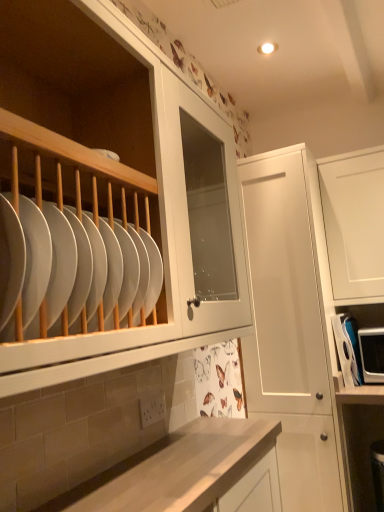
Question: Is point (349, 320) positioned closer to the camera than point (117, 284)?

Choices:
 (A) farther
 (B) closer

Answer: (A)

Question: From the image's perspective, is white plastic microwave at right located above or below white glossy plate at left?

Choices:
 (A) above
 (B) below

Answer: (B)

Question: Estimate the real-world distances between objects in this image. Which object is closer to the white glossy plate at left?

Choices:
 (A) white plastic microwave at right
 (B) white matte cabinet at center

Answer: (B)

Question: Based on their relative distances, which object is nearer to the white matte cabinet at center?

Choices:
 (A) white glossy plate at left
 (B) white plastic microwave at right

Answer: (B)